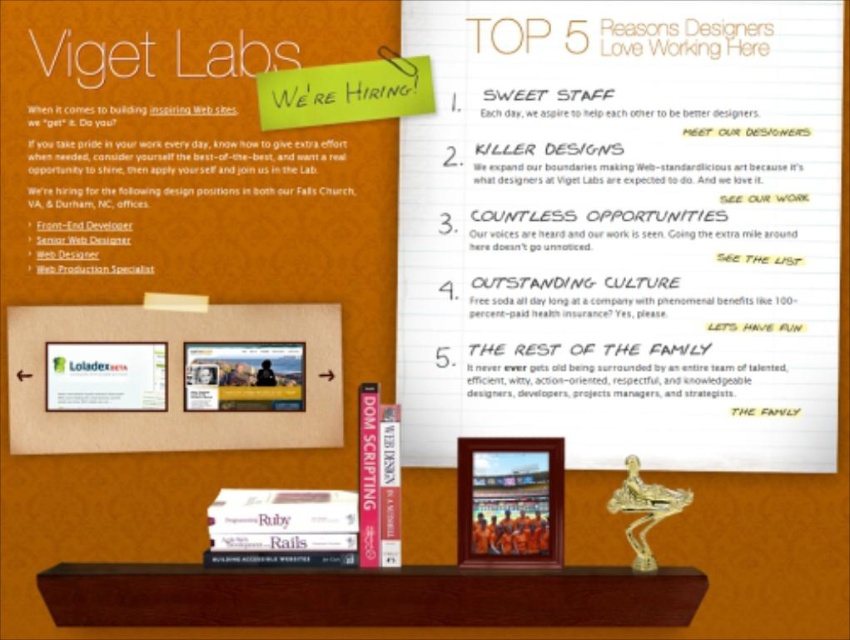
Consider the image. You are standing in front of the Viget Labs promotional graphic. There is a point at coordinates point (460, 317). Can you reach this point with your hand if you extend it fully?

The point (460, 317) is 1.43 meters from the viewer. Since the average human arm length is about 0.7 meters, you cannot reach it with your hand extended fully.

You are a job seeker looking at the Viget Labs graphic. You notice two points marked in the image. Which point is closer to the camera, point (585, 426) or point (17, 432)?

Point (585, 426) is further to the camera than point (17, 432). Therefore, point (17, 432) is closer to the camera.